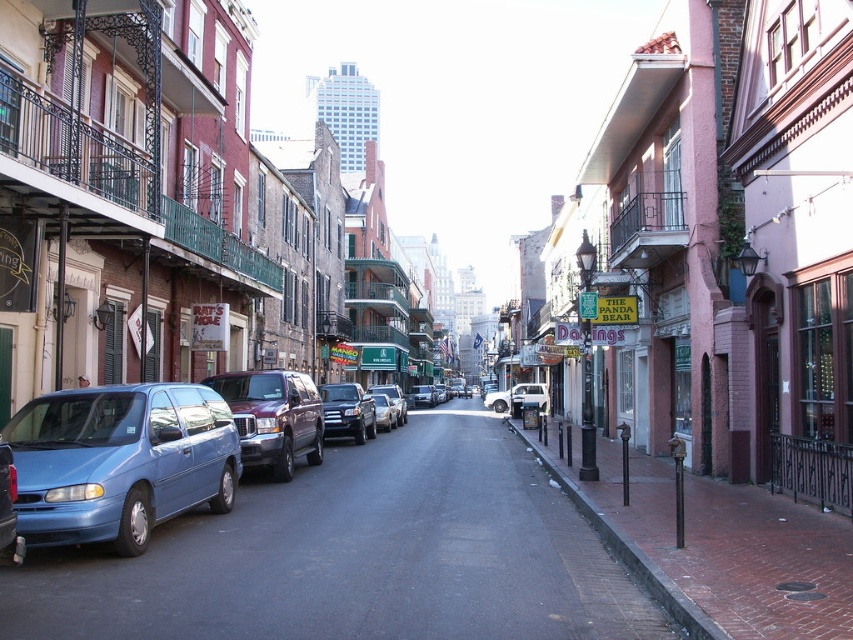
Based on the photo, you are a delivery driver who needs to park your vehicle between the satin black suv at center and the shiny silver suv at center. Given that your vehicle is 4.5 meters long, will there be enough space between these two SUVs to park your car?

The satin black suv at center has a smaller size compared to the shiny silver suv at center. However, without knowing the exact distance between them, it is impossible to determine if there is enough space for a 4.5 meter vehicle. Please check the available space between the two SUVs.

You are driving a delivery van that is 18 feet long. You need to park between two SUVs on a narrow street. The two SUVs are the satin black suv at center and the shiny silver suv at center. Can your van fit between them?

The distance between the satin black suv at center and the shiny silver suv at center is 25.31 feet. Since your van is 18 feet long, it can fit between them as there is enough space.

You are a delivery driver who needs to park your vehicle in this street. The parking spot is marked by the point at coordinates (273, 417). Can you safely park your delivery van there without blocking the maroon metallic suv at left?

The point at coordinates (273, 417) indicates the maroon metallic suv at left is already parked there, so you cannot park your delivery van there without blocking it.